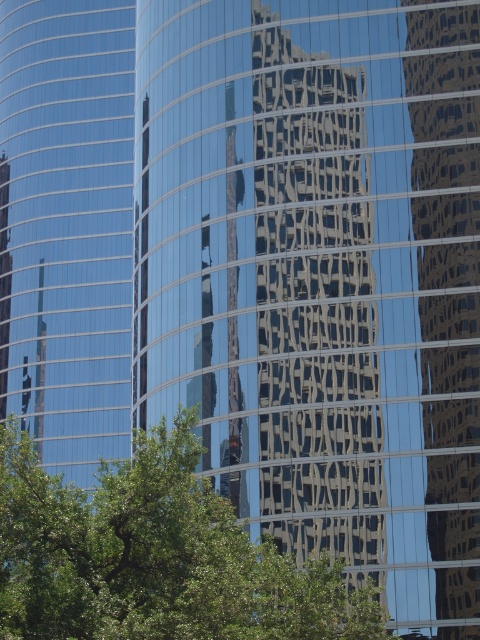
You are standing in front of the modern curved glass skyscraper and notice a point marked at coordinates (154, 556). Based on the scene description, what object is located at that point?

The point at coordinates (154, 556) marks the green leafy tree at center.

What are the coordinates of the green leafy tree at center?

The green leafy tree at center is located at coordinates point [154,556].

You are standing in front of the modern glass skyscraper and notice the green leafy tree at center and the glossy glass building at center. Which object is closer to your viewpoint?

The green leafy tree at center is positioned under the glossy glass building at center, meaning the tree is closer to your viewpoint than the building.